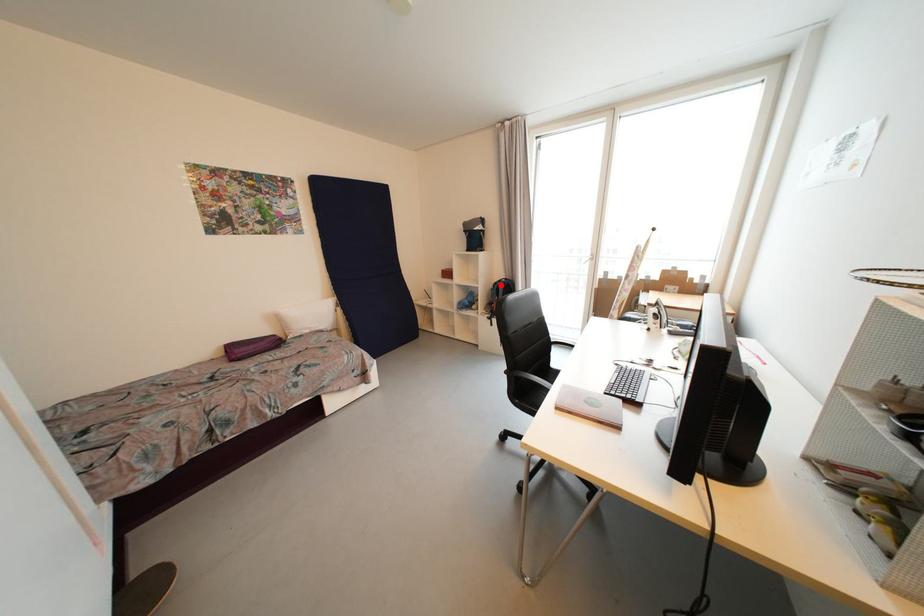
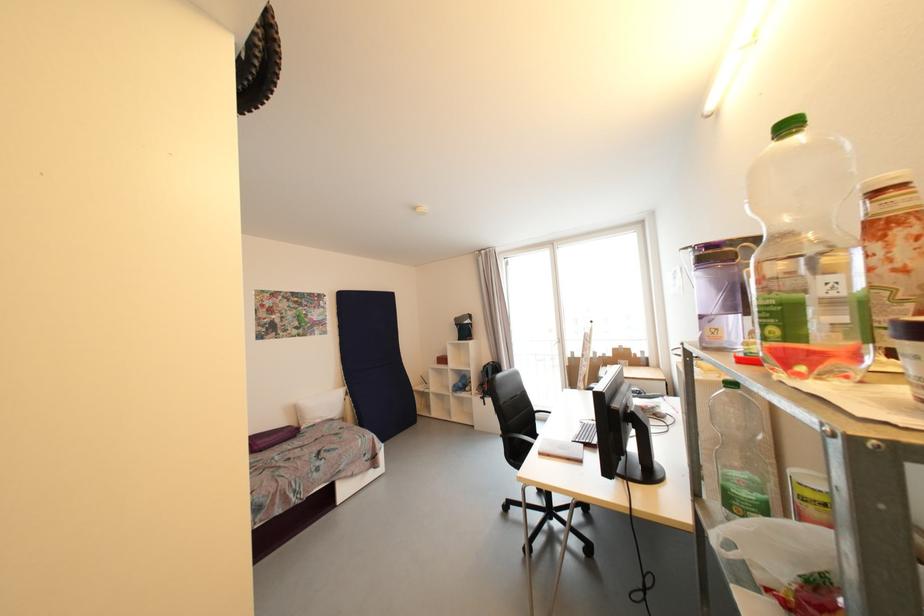
The point at the highlighted location is marked in the first image. Where is the corresponding point in the second image?

(490, 368)